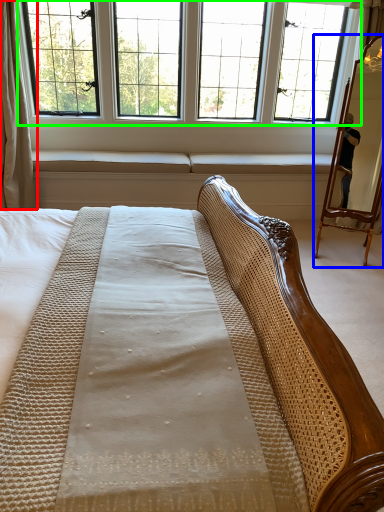
Question: Which object is positioned farthest from curtain (highlighted by a red box)? Select from mirror (highlighted by a blue box) and window (highlighted by a green box).

Choices:
 (A) mirror
 (B) window

Answer: (A)